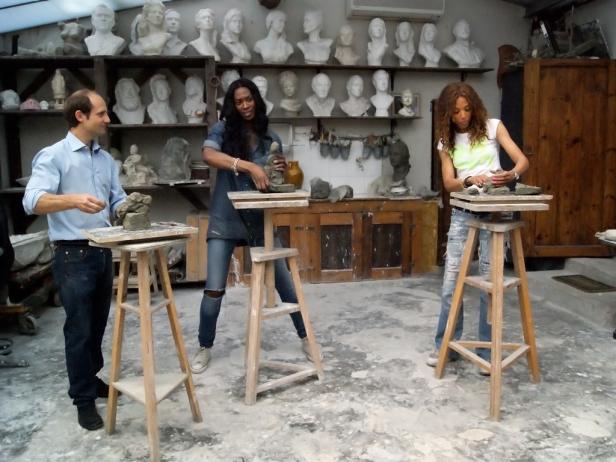
Where is `the chest`? The width and height of the screenshot is (616, 462). the chest is located at coordinates (578, 154).